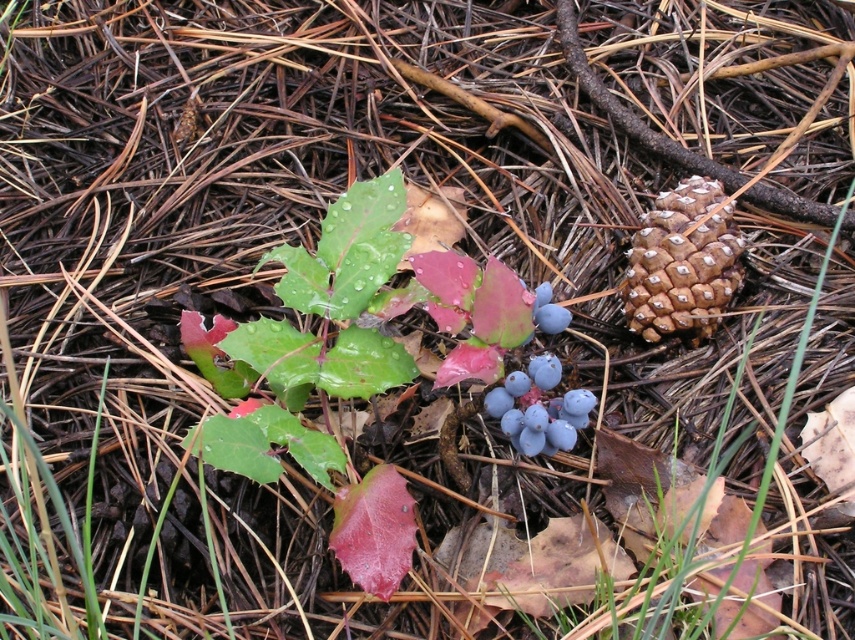
Between brown rough pine cone at right and blue matte berries at center, which one appears on the left side from the viewer's perspective?

Positioned to the left is blue matte berries at center.

I want to click on brown rough pine cone at right, so click(x=682, y=262).